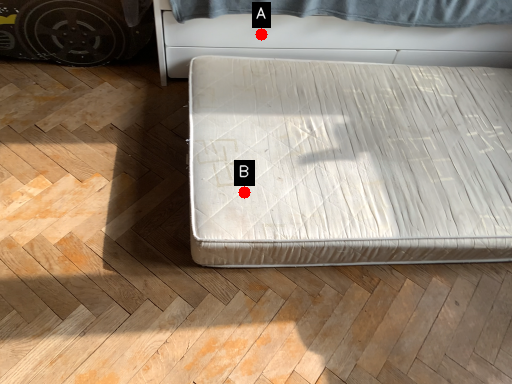
Question: Two points are circled on the image, labeled by A and B beside each circle. Which of the following is the farthest from the observer?

Choices:
 (A) A is further
 (B) B is further

Answer: (A)